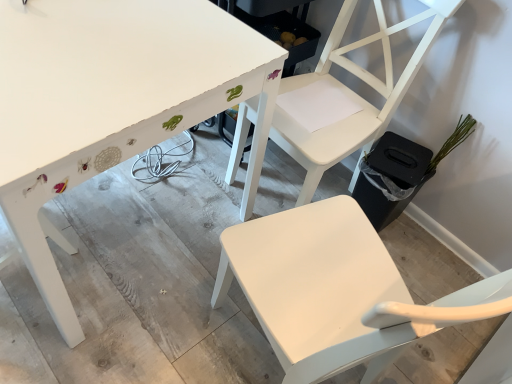
Question: Is white matte chair at upper center, the 1th chair positioned from the bottom, turned away from white matte chair at upper right, the 2th chair when ordered from bottom to top?

Choices:
 (A) yes
 (B) no

Answer: (B)

Question: From the image's perspective, is white matte chair at upper center, the 1th chair positioned from the bottom, above white matte chair at upper right, which is the first chair in top-to-bottom order?

Choices:
 (A) yes
 (B) no

Answer: (B)

Question: Is white matte chair at upper center, positioned as the 2th chair in top-to-bottom order, not near white matte chair at upper right, which is the first chair in top-to-bottom order?

Choices:
 (A) yes
 (B) no

Answer: (B)

Question: Does white matte chair at upper center, the 1th chair positioned from the bottom, turn towards white matte chair at upper right, which is the first chair in top-to-bottom order?

Choices:
 (A) yes
 (B) no

Answer: (B)

Question: Can we say white matte chair at upper center, the 1th chair positioned from the bottom, lies outside white matte chair at upper right, the 2th chair when ordered from bottom to top?

Choices:
 (A) yes
 (B) no

Answer: (A)

Question: Does white matte chair at upper center, positioned as the 2th chair in top-to-bottom order, appear on the left side of white matte chair at upper right, the 2th chair when ordered from bottom to top?

Choices:
 (A) no
 (B) yes

Answer: (B)

Question: Is white matte chair at upper center, the 1th chair positioned from the bottom, facing towards white painted wood table at upper left?

Choices:
 (A) yes
 (B) no

Answer: (A)

Question: Does white matte chair at upper center, positioned as the 2th chair in top-to-bottom order, have a lesser height compared to white painted wood table at upper left?

Choices:
 (A) no
 (B) yes

Answer: (A)

Question: Does white matte chair at upper center, the 1th chair positioned from the bottom, have a smaller size compared to white painted wood table at upper left?

Choices:
 (A) yes
 (B) no

Answer: (A)

Question: Does white matte chair at upper center, positioned as the 2th chair in top-to-bottom order, have a larger size compared to white painted wood table at upper left?

Choices:
 (A) no
 (B) yes

Answer: (A)

Question: From the image's perspective, does white matte chair at upper center, positioned as the 2th chair in top-to-bottom order, appear lower than white painted wood table at upper left?

Choices:
 (A) no
 (B) yes

Answer: (B)

Question: From a real-world perspective, is white matte chair at upper center, the 1th chair positioned from the bottom, physically above white painted wood table at upper left?

Choices:
 (A) yes
 (B) no

Answer: (A)

Question: From a real-world perspective, is white matte chair at upper right, the 2th chair when ordered from bottom to top, physically above white matte chair at upper center, the 1th chair positioned from the bottom?

Choices:
 (A) yes
 (B) no

Answer: (B)